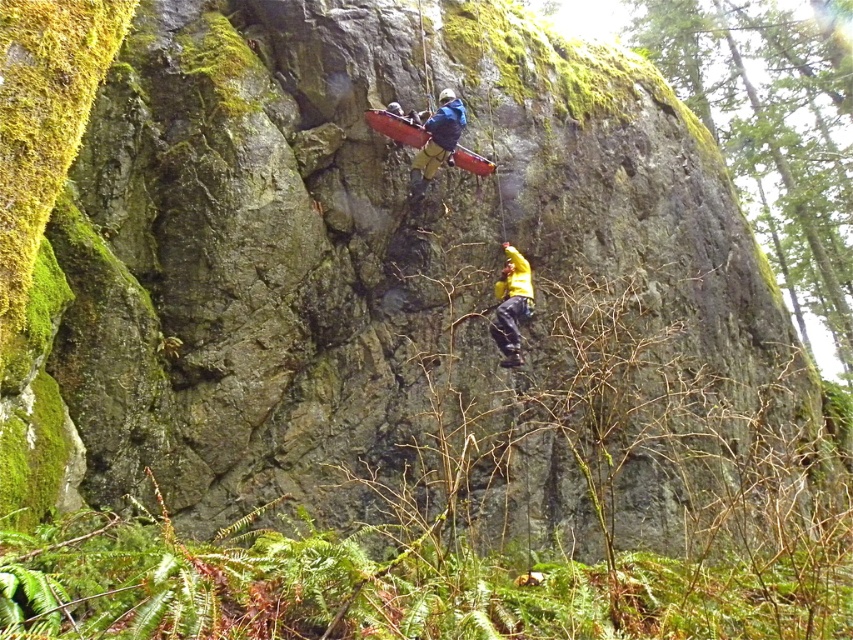
Question: Does yellow fabric at center appear on the right side of blue fabric harness at upper center?

Choices:
 (A) yes
 (B) no

Answer: (A)

Question: Is yellow fabric at center to the right of blue fabric harness at upper center from the viewer's perspective?

Choices:
 (A) yes
 (B) no

Answer: (A)

Question: Does yellow fabric at center come behind blue fabric harness at upper center?

Choices:
 (A) yes
 (B) no

Answer: (B)